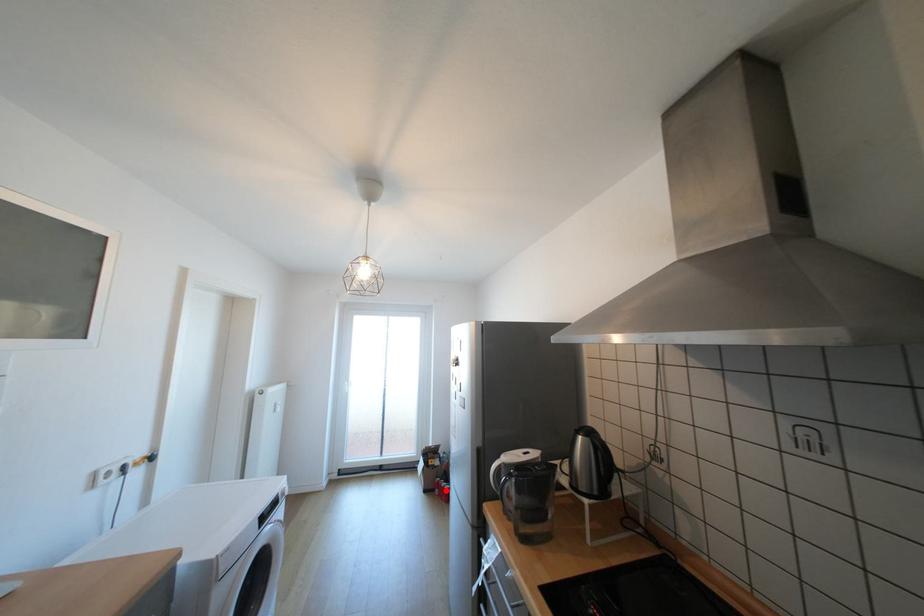
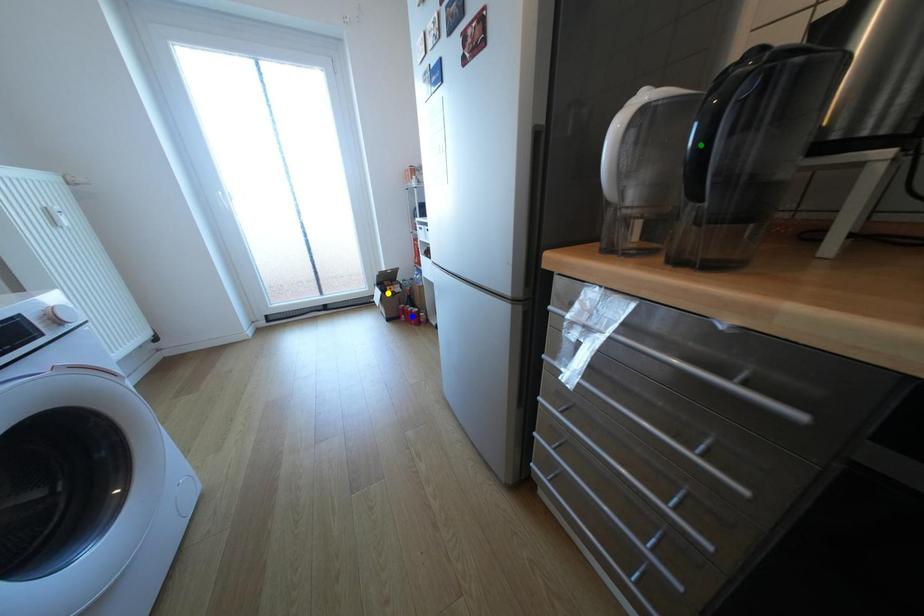
Question: I am providing you with two images of the same scene from different viewpoints. A red point is marked on the first image. You are given multiple points on the second image. Can you choose the point in image 2 that corresponds to the point in image 1?

Choices:
 (A) blue point
 (B) green point
 (C) yellow point

Answer: (A)